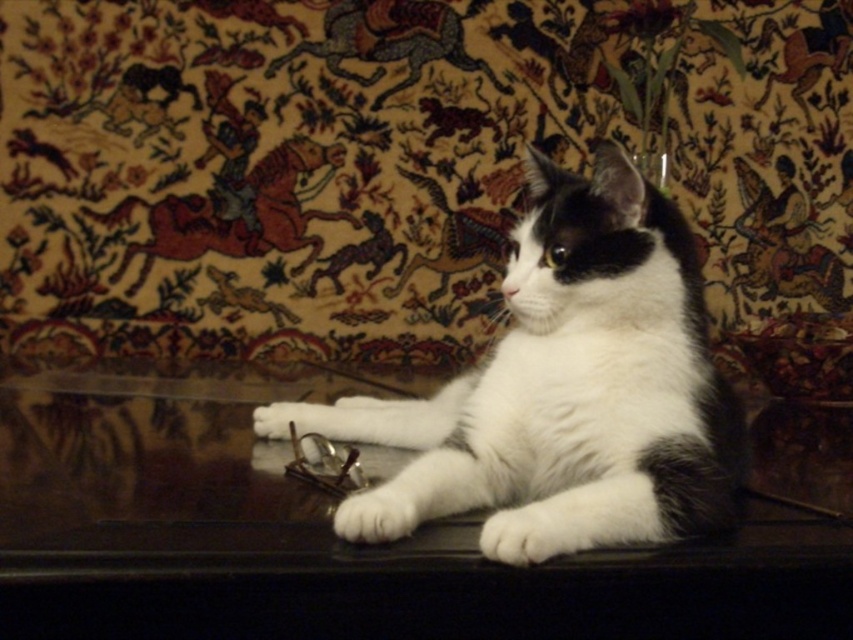
Does point (167, 580) come closer to viewer compared to point (543, 548)?

Yes.

Describe the element at coordinates (326, 532) in the screenshot. I see `glossy dark wood table at center` at that location.

Image resolution: width=853 pixels, height=640 pixels. I want to click on glossy dark wood table at center, so point(326,532).

The width and height of the screenshot is (853, 640). What do you see at coordinates (527, 532) in the screenshot?
I see `white fur at lower center` at bounding box center [527, 532].

Who is positioned more to the right, white fur at lower center or white fur paw at lower center?

white fur at lower center is more to the right.

Which is behind, point (498, 524) or point (399, 520)?

The point (399, 520) is behind.

Locate an element on the screen. white fur at lower center is located at coordinates (527, 532).

The width and height of the screenshot is (853, 640). Describe the element at coordinates (575, 376) in the screenshot. I see `white fur cat at center` at that location.

Is white fur cat at center positioned before white fur paw at lower center?

That is False.

What do you see at coordinates (575, 376) in the screenshot? I see `white fur cat at center` at bounding box center [575, 376].

This screenshot has height=640, width=853. I want to click on white fur cat at center, so (x=575, y=376).